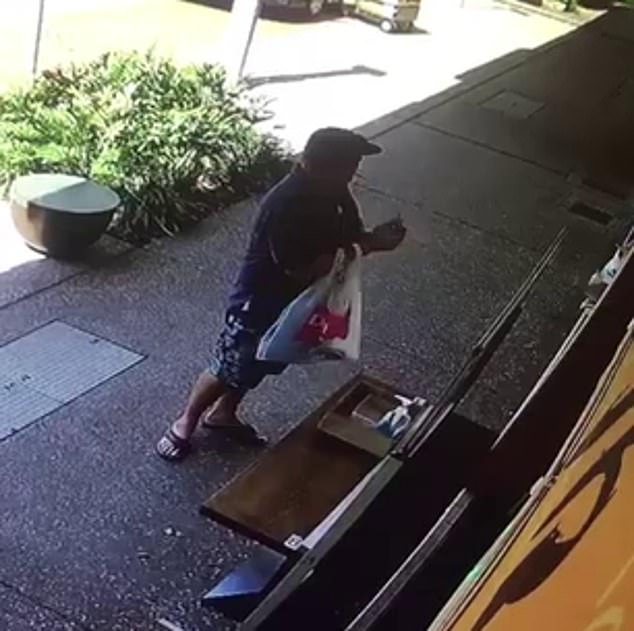
Where is `empty plant pot`? The image size is (634, 631). empty plant pot is located at coordinates (61, 237).